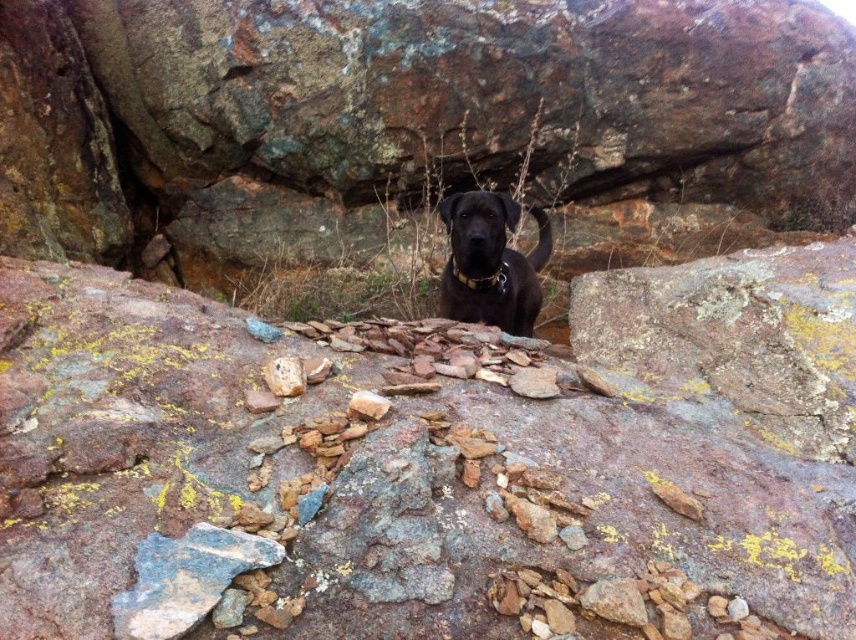
Is rusty rock at center smaller than shiny black dog at center?

Actually, rusty rock at center might be larger than shiny black dog at center.

Between rusty rock at center and shiny black dog at center, which one is positioned higher?

Positioned higher is shiny black dog at center.

In the scene shown: Who is more distant from viewer, (177, 492) or (461, 196)?

The point (461, 196) is behind.

Locate an element on the screen. The height and width of the screenshot is (640, 856). rusty rock at center is located at coordinates (428, 468).